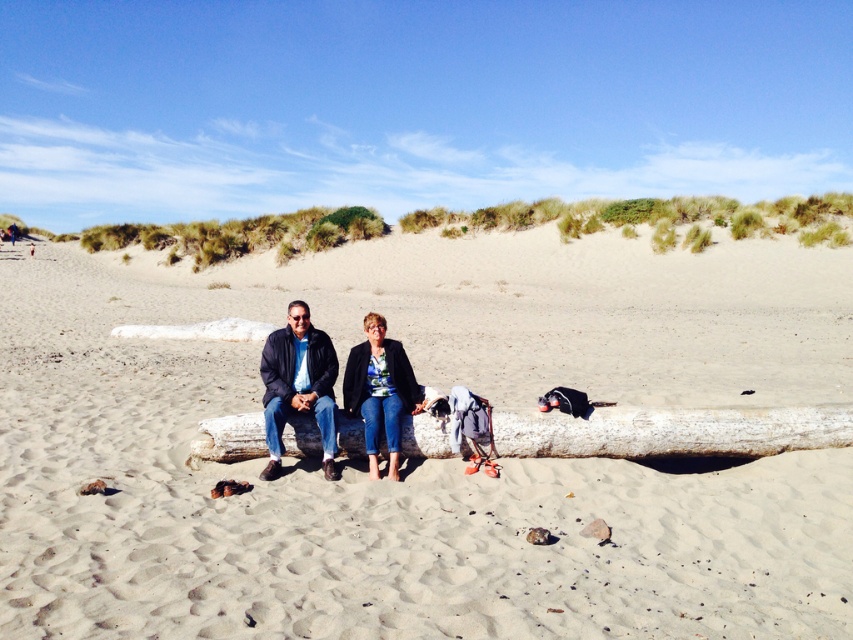
Is dark blue leather jacket at center shorter than denim jacket at center?

Incorrect, dark blue leather jacket at center's height does not fall short of denim jacket at center's.

Does dark blue leather jacket at center appear on the right side of denim jacket at center?

No, dark blue leather jacket at center is not to the right of denim jacket at center.

Is point (277, 465) behind point (370, 372)?

No, it is not.

Locate an element on the screen. Image resolution: width=853 pixels, height=640 pixels. dark blue leather jacket at center is located at coordinates (299, 385).

Which is more to the right, smooth sand at center or dark blue leather jacket at center?

From the viewer's perspective, smooth sand at center appears more on the right side.

Who is more distant from viewer, [209,612] or [326,432]?

The point [326,432] is more distant.

Where is `smooth sand at center`? This screenshot has height=640, width=853. smooth sand at center is located at coordinates (428, 460).

Is point (494, 429) in front of point (366, 356)?

Yes, point (494, 429) is closer to viewer.

Which of these two, smooth white log at center or denim jacket at center, stands shorter?

smooth white log at center

Between point (521, 449) and point (374, 422), which one is positioned in front?

Point (374, 422)

Find the location of a particular element. Image resolution: width=853 pixels, height=640 pixels. smooth white log at center is located at coordinates (672, 432).